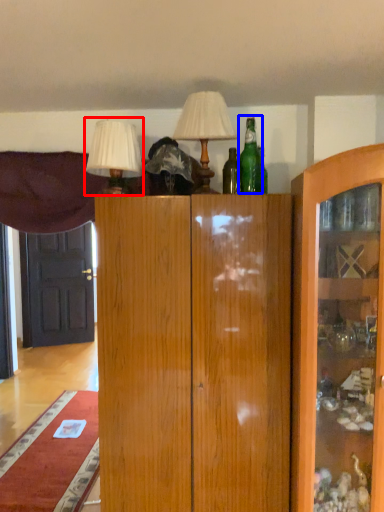
Question: Which object appears farthest to the camera in this image, table lamp (highlighted by a red box) or bottle (highlighted by a blue box)?

Choices:
 (A) table lamp
 (B) bottle

Answer: (B)